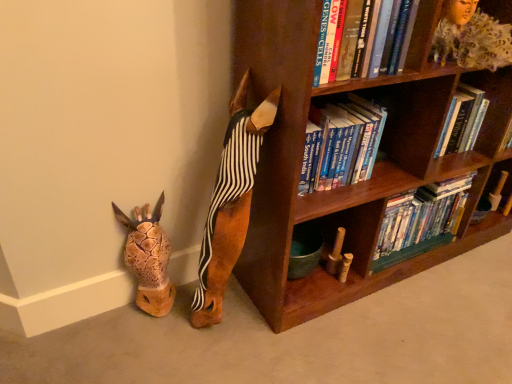
Find the location of `wooden giraffe head at lower left, which ranks as the 2th animal in right-to-left order`. wooden giraffe head at lower left, which ranks as the 2th animal in right-to-left order is located at coordinates (148, 258).

Image resolution: width=512 pixels, height=384 pixels. Describe the element at coordinates (358, 183) in the screenshot. I see `brown wooden bookcase at upper right` at that location.

What is the approximate height of wooden bookshelf at upper right?

The height of wooden bookshelf at upper right is 6.92 inches.

Identify the location of wooden giraffe head at lower left, which ranks as the 2th animal in right-to-left order. (148, 258).

Consider the image. Is wooden giraffe head at lower left, which ranks as the 2th animal in right-to-left order, smaller than wooden bookshelf at upper right?

Indeed, wooden giraffe head at lower left, which ranks as the 2th animal in right-to-left order, has a smaller size compared to wooden bookshelf at upper right.

From the image's perspective, is wooden giraffe head at lower left, arranged as the first animal when viewed from the left, beneath wooden bookshelf at upper right?

Indeed, from the image's perspective, wooden giraffe head at lower left, arranged as the first animal when viewed from the left, is shown beneath wooden bookshelf at upper right.

Does wooden giraffe head at lower left, arranged as the first animal when viewed from the left, touch wooden bookshelf at upper right?

No, wooden giraffe head at lower left, arranged as the first animal when viewed from the left, is not in contact with wooden bookshelf at upper right.

In the scene shown: Is wooden giraffe head at lower left, arranged as the first animal when viewed from the left, aimed at brown wooden dog at center, which appears as the 2th animal when viewed from the left?

No, wooden giraffe head at lower left, arranged as the first animal when viewed from the left, is not turned towards brown wooden dog at center, which appears as the 2th animal when viewed from the left.

Between wooden giraffe head at lower left, arranged as the first animal when viewed from the left, and brown wooden dog at center, placed as the first animal when sorted from right to left, which one has larger width?

brown wooden dog at center, placed as the first animal when sorted from right to left, is wider.

Between wooden giraffe head at lower left, arranged as the first animal when viewed from the left, and brown wooden dog at center, placed as the first animal when sorted from right to left, which one has less height?

wooden giraffe head at lower left, arranged as the first animal when viewed from the left, is shorter.

Based on the photo, can you tell me how much wooden giraffe head at lower left, arranged as the first animal when viewed from the left, and hardcover book at upper center, which is the 2th book from bottom to top, differ in facing direction?

The angular difference between wooden giraffe head at lower left, arranged as the first animal when viewed from the left, and hardcover book at upper center, which is the 2th book from bottom to top, is 2.51 degrees.

Considering the relative sizes of wooden giraffe head at lower left, arranged as the first animal when viewed from the left, and hardcover book at upper center, arranged as the first book when viewed from the top, in the image provided, is wooden giraffe head at lower left, arranged as the first animal when viewed from the left, smaller than hardcover book at upper center, arranged as the first book when viewed from the top,?

Yes.

From the picture: Which point is more distant from viewer, [139,233] or [352,45]?

The point [139,233] is farther.

From a real-world perspective, is wooden giraffe head at lower left, which ranks as the 2th animal in right-to-left order, under hardcover book at upper center, placed as the 1th book when sorted from front to back?

Yes, from a real-world perspective, wooden giraffe head at lower left, which ranks as the 2th animal in right-to-left order, is beneath hardcover book at upper center, placed as the 1th book when sorted from front to back.

Consider the image. From the image's perspective, is hardcover books at upper right under wooden giraffe head at lower left, which ranks as the 2th animal in right-to-left order?

Incorrect, from the image's perspective, hardcover books at upper right is higher than wooden giraffe head at lower left, which ranks as the 2th animal in right-to-left order.

Who is shorter, hardcover books at upper right or wooden giraffe head at lower left, arranged as the first animal when viewed from the left?

hardcover books at upper right is shorter.

Is the depth of hardcover books at upper right greater than that of wooden giraffe head at lower left, arranged as the first animal when viewed from the left?

Yes, it is behind wooden giraffe head at lower left, arranged as the first animal when viewed from the left.

Relative to hardcover books at upper right, is hardcover book at upper center, the 2th book in the back-to-front sequence, in front or behind?

Visually, hardcover book at upper center, the 2th book in the back-to-front sequence, is located in front of hardcover books at upper right.

Who is bigger, hardcover book at upper center, which is the 2th book from bottom to top, or hardcover books at upper right?

With larger size is hardcover book at upper center, which is the 2th book from bottom to top.

From the image's perspective, is hardcover book at upper center, placed as the 1th book when sorted from front to back, located above or below hardcover books at upper right?

Clearly, from the image's perspective, hardcover book at upper center, placed as the 1th book when sorted from front to back, is above hardcover books at upper right.

What's the angular difference between hardcover book at upper center, which is the 2th book from bottom to top, and hardcover books at upper right's facing directions?

3.4 degrees separate the facing orientations of hardcover book at upper center, which is the 2th book from bottom to top, and hardcover books at upper right.

Does hardcover books at center, the 1th book from the back, have a greater width compared to wooden bookshelf at upper right?

No, hardcover books at center, the 1th book from the back, is not wider than wooden bookshelf at upper right.

Locate an element on the screen. This screenshot has height=384, width=512. shelf that is above the hardcover books at center, positioned as the first book in bottom-to-top order (from a real-world perspective) is located at coordinates (471, 37).

In the scene shown: Is hardcover books at center, the 1th book from the back, looking in the opposite direction of wooden bookshelf at upper right?

hardcover books at center, the 1th book from the back, does not have its back to wooden bookshelf at upper right.

From the image's perspective, is hardcover books at center, positioned as the first book in bottom-to-top order, below wooden bookshelf at upper right?

Correct, hardcover books at center, positioned as the first book in bottom-to-top order, appears lower than wooden bookshelf at upper right in the image.

Is hardcover book at upper center, arranged as the first book when viewed from the top, not inside wooden bookshelf at upper right?

hardcover book at upper center, arranged as the first book when viewed from the top, lies outside wooden bookshelf at upper right's area.

Is hardcover book at upper center, arranged as the first book when viewed from the top, not close to wooden bookshelf at upper right?

No, hardcover book at upper center, arranged as the first book when viewed from the top, is not far away from wooden bookshelf at upper right.

Is hardcover book at upper center, the 2th book in the back-to-front sequence, turned away from wooden bookshelf at upper right?

hardcover book at upper center, the 2th book in the back-to-front sequence, is not turned away from wooden bookshelf at upper right.

I want to click on shelf on the right of the wooden giraffe head at lower left, which ranks as the 2th animal in right-to-left order, so click(471, 37).

The height and width of the screenshot is (384, 512). What are the coordinates of `animal on the left of brown wooden dog at center, placed as the first animal when sorted from right to left` in the screenshot? It's located at (148, 258).

Estimate the real-world distances between objects in this image. Which object is closer to hardcover book at upper center, arranged as the first book when viewed from the top, hardcover books at upper right or wooden bookshelf at upper right?

wooden bookshelf at upper right is positioned closer to the anchor hardcover book at upper center, arranged as the first book when viewed from the top.

In the scene shown: Which object lies nearer to the anchor point brown wooden bookcase at upper right, hardcover book at upper center, placed as the 1th book when sorted from front to back, or brown wooden dog at center, which appears as the 2th animal when viewed from the left?

Based on the image, brown wooden dog at center, which appears as the 2th animal when viewed from the left, appears to be nearer to brown wooden bookcase at upper right.

Looking at the image, which one is located closer to hardcover books at center, positioned as the first book in bottom-to-top order, wooden bookshelf at upper right or hardcover book at upper center, arranged as the first book when viewed from the top?

The object closer to hardcover books at center, positioned as the first book in bottom-to-top order, is wooden bookshelf at upper right.

Looking at this image, based on their spatial positions, is hardcover books at center, which ranks as the 2th book in top-to-bottom order, or hardcover books at upper right further from brown wooden bookcase at upper right?

Based on the image, hardcover books at upper right appears to be further to brown wooden bookcase at upper right.

Based on the photo, which object lies nearer to the anchor point wooden giraffe head at lower left, arranged as the first animal when viewed from the left, brown wooden dog at center, which appears as the 2th animal when viewed from the left, or hardcover books at center, positioned as the first book in bottom-to-top order?

brown wooden dog at center, which appears as the 2th animal when viewed from the left, is positioned closer to the anchor wooden giraffe head at lower left, arranged as the first animal when viewed from the left.

When comparing their distances from hardcover books at upper right, does hardcover books at center, which ranks as the 2th book in top-to-bottom order, or hardcover book at upper center, placed as the 1th book when sorted from front to back, seem closer?

hardcover books at center, which ranks as the 2th book in top-to-bottom order, is closer to hardcover books at upper right.

From the picture: Looking at the image, which one is located closer to hardcover books at center, the second book when ordered from front to back, hardcover book at upper center, which is the 2th book from bottom to top, or brown wooden bookcase at upper right?

brown wooden bookcase at upper right.

When comparing their distances from brown wooden dog at center, placed as the first animal when sorted from right to left, does wooden giraffe head at lower left, which ranks as the 2th animal in right-to-left order, or hardcover books at upper right seem closer?

Among the two, wooden giraffe head at lower left, which ranks as the 2th animal in right-to-left order, is located nearer to brown wooden dog at center, placed as the first animal when sorted from right to left.

I want to click on animal between wooden giraffe head at lower left, arranged as the first animal when viewed from the left, and brown wooden bookcase at upper right, so click(231, 202).

Where is `bookcase between hardcover book at upper center, arranged as the first book when viewed from the top, and wooden bookshelf at upper right, in the horizontal direction`? This screenshot has height=384, width=512. bookcase between hardcover book at upper center, arranged as the first book when viewed from the top, and wooden bookshelf at upper right, in the horizontal direction is located at coordinates (358, 183).

You are a GUI agent. You are given a task and a screenshot of the screen. Output one action in this format:
    pyautogui.click(x=<x>, y=<y>)
    Task: Click on the bookcase located between brown wooden dog at center, which appears as the 2th animal when viewed from the left, and hardcover books at upper right in the left-right direction
    
    Given the screenshot: What is the action you would take?
    pyautogui.click(x=358, y=183)

Locate an element on the screen. Image resolution: width=512 pixels, height=384 pixels. book between brown wooden bookcase at upper right and hardcover books at center, which ranks as the 2th book in top-to-bottom order, along the z-axis is located at coordinates (355, 40).